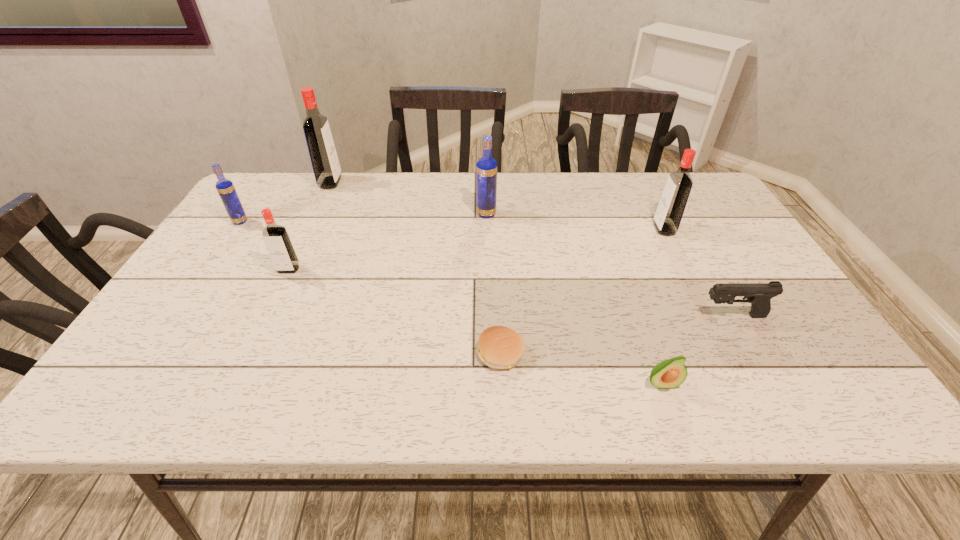
Where is `vacant space situated 0.250m on the front of the smaller blue vodka`? This screenshot has height=540, width=960. vacant space situated 0.250m on the front of the smaller blue vodka is located at coordinates click(x=196, y=287).

The height and width of the screenshot is (540, 960). I want to click on vacant space located 0.360m on the front and back of the smallest red vodka, so coord(226,401).

Image resolution: width=960 pixels, height=540 pixels. I want to click on vacant space located 0.070m at the barrel of the pistol, so click(x=670, y=315).

Image resolution: width=960 pixels, height=540 pixels. What are the coordinates of `blank area located at the barrel of the pistol` in the screenshot? It's located at (643, 315).

You are a GUI agent. You are given a task and a screenshot of the screen. Output one action in this format:
    pyautogui.click(x=<x>, y=<y>)
    Task: Click on the blank area located 0.350m at the barrel of the pistol
    
    Given the screenshot: What is the action you would take?
    pyautogui.click(x=547, y=315)

This screenshot has height=540, width=960. Find the location of `vacant space located 0.360m on the back of the shortest object`. vacant space located 0.360m on the back of the shortest object is located at coordinates (495, 235).

Find the location of a particular element. The image size is (960, 540). avocado present at the near edge is located at coordinates click(x=667, y=374).

Find the location of `patty positioned at the near edge`. patty positioned at the near edge is located at coordinates (499, 347).

Find the location of `object present at the left edge`. object present at the left edge is located at coordinates 226,190.

Identify the location of object located in the right edge section of the desktop. The width and height of the screenshot is (960, 540). (759, 295).